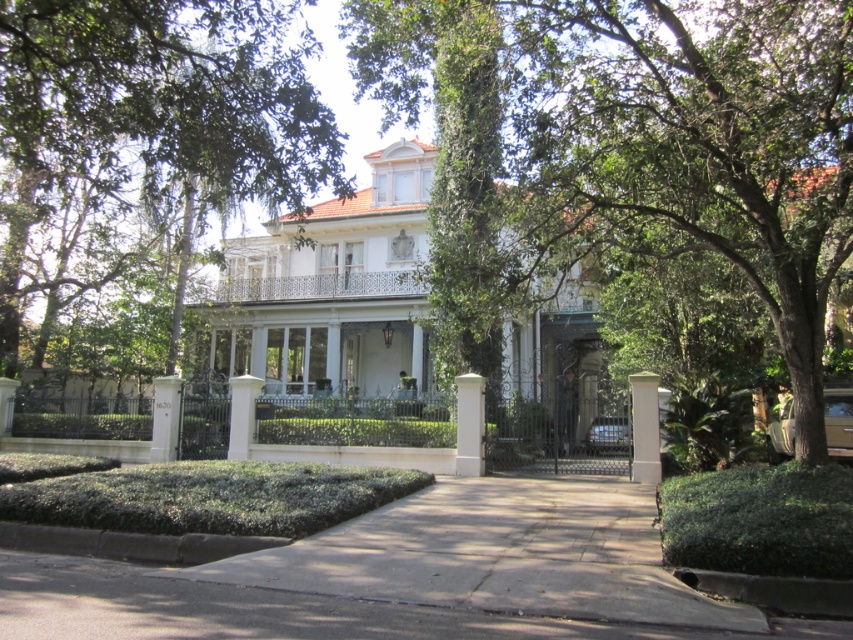
You are a photographer standing at the entrance of the property. You want to capture a photo that includes both the white glossy mansion at center and the white painted concrete pillar at lower left. Considering their heights, which object will appear taller in the photo?

The white glossy mansion at center will appear taller in the photo since it has a greater height compared to the white painted concrete pillar at lower left according to the description.

You are standing at the entrance of the grand house and want to know the position of the green leafy tree at center. Can you determine if it is closer to the front porch or the driveway?

The green leafy tree at center is located at point coordinates that are closer to the front porch than the driveway, so it is positioned nearer to the porch area.

You are a delivery driver with a truck that is 2.5 meters wide. You need to deliver a package to the house but the wrought iron gates are closed. You see the paved concrete driveway at center and the white painted concrete pillar at lower left. Can you drive your truck between them to enter the property?

The paved concrete driveway at center and white painted concrete pillar at lower left are 10.59 meters apart. Since the distance between them is much wider than the truck width of 2.5 meters, the truck can easily pass through the space between them to enter the property.